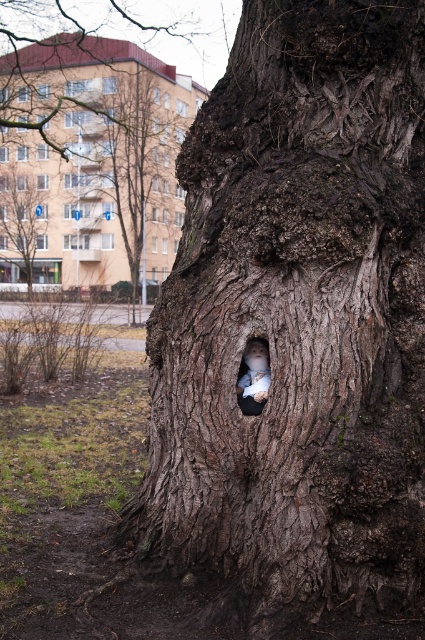
Is dark brown rough bark at upper center below white fur face at center?

Actually, dark brown rough bark at upper center is above white fur face at center.

Which is above, dark brown rough bark at upper center or white fur face at center?

dark brown rough bark at upper center is above.

Where is `dark brown rough bark at upper center`? This screenshot has width=425, height=640. dark brown rough bark at upper center is located at coordinates (96, 20).

Locate an element on the screen. The image size is (425, 640). dark brown rough bark at upper center is located at coordinates (96, 20).

Who is lower down, smooth bark tree at upper left or white plush toy at center?

white plush toy at center is below.

This screenshot has width=425, height=640. Describe the element at coordinates (23, 228) in the screenshot. I see `smooth bark tree at upper left` at that location.

You are a GUI agent. You are given a task and a screenshot of the screen. Output one action in this format:
    pyautogui.click(x=<x>, y=<y>)
    Task: Click on the smooth bark tree at upper left
    
    Given the screenshot: What is the action you would take?
    [x=23, y=228]

Does dark brown rough bark at center have a smaller size compared to white fur face at center?

No, dark brown rough bark at center is not smaller than white fur face at center.

Where is `dark brown rough bark at center`? dark brown rough bark at center is located at coordinates (297, 321).

Where is `dark brown rough bark at center`? The width and height of the screenshot is (425, 640). dark brown rough bark at center is located at coordinates (297, 321).